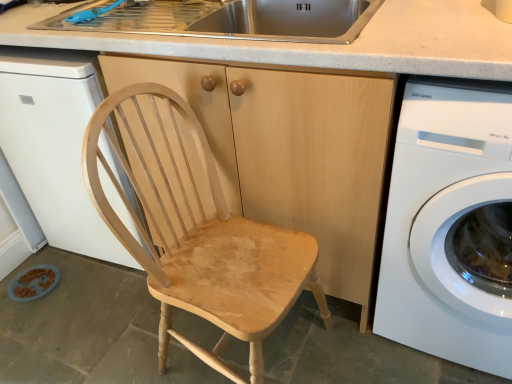
Question: Does white glossy washing machine at right have a greater height compared to light wood cabinet at center?

Choices:
 (A) yes
 (B) no

Answer: (B)

Question: Considering the relative sizes of white glossy washing machine at right and light wood cabinet at center in the image provided, is white glossy washing machine at right bigger than light wood cabinet at center?

Choices:
 (A) yes
 (B) no

Answer: (B)

Question: Is the position of white glossy washing machine at right less distant than that of light wood cabinet at center?

Choices:
 (A) no
 (B) yes

Answer: (B)

Question: From the image's perspective, does white glossy washing machine at right appear higher than light wood cabinet at center?

Choices:
 (A) no
 (B) yes

Answer: (A)

Question: Considering the relative positions of white glossy washing machine at right and light wood cabinet at center in the image provided, is white glossy washing machine at right behind light wood cabinet at center?

Choices:
 (A) no
 (B) yes

Answer: (A)

Question: From a real-world perspective, is white glossy washing machine at right on top of light wood cabinet at center?

Choices:
 (A) no
 (B) yes

Answer: (A)

Question: Does white glossy dishwasher at left have a lesser height compared to light wood cabinet at center?

Choices:
 (A) yes
 (B) no

Answer: (A)

Question: Is white glossy dishwasher at left looking in the opposite direction of light wood cabinet at center?

Choices:
 (A) no
 (B) yes

Answer: (A)

Question: Would you say white glossy dishwasher at left is a long distance from light wood cabinet at center?

Choices:
 (A) no
 (B) yes

Answer: (A)

Question: Is white glossy dishwasher at left smaller than light wood cabinet at center?

Choices:
 (A) yes
 (B) no

Answer: (A)

Question: Does white glossy dishwasher at left appear on the right side of light wood cabinet at center?

Choices:
 (A) no
 (B) yes

Answer: (A)

Question: Is white glossy dishwasher at left placed right next to light wood cabinet at center?

Choices:
 (A) yes
 (B) no

Answer: (B)

Question: From a real-world perspective, is blue plastic faucet at upper left over white glossy washing machine at right?

Choices:
 (A) no
 (B) yes

Answer: (B)